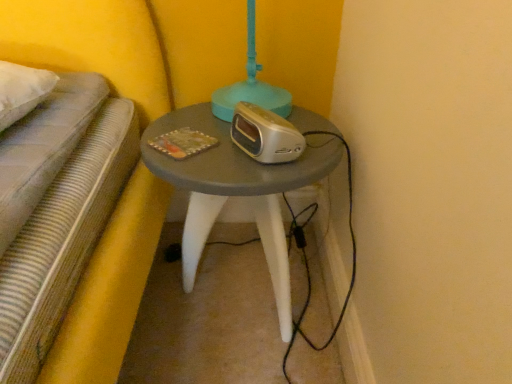
The height and width of the screenshot is (384, 512). What are the coordinates of `vacant space situated on the left part of silver metallic alarm clock at center` in the screenshot? It's located at (203, 145).